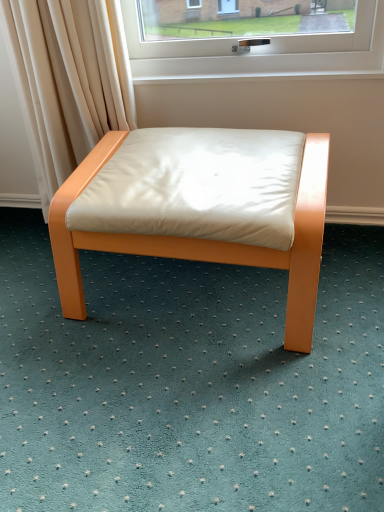
What do you see at coordinates (203, 240) in the screenshot?
I see `white leather stool at center` at bounding box center [203, 240].

Where is `white leather stool at center`? The image size is (384, 512). white leather stool at center is located at coordinates (203, 240).

The image size is (384, 512). I want to click on white leather stool at center, so click(x=203, y=240).